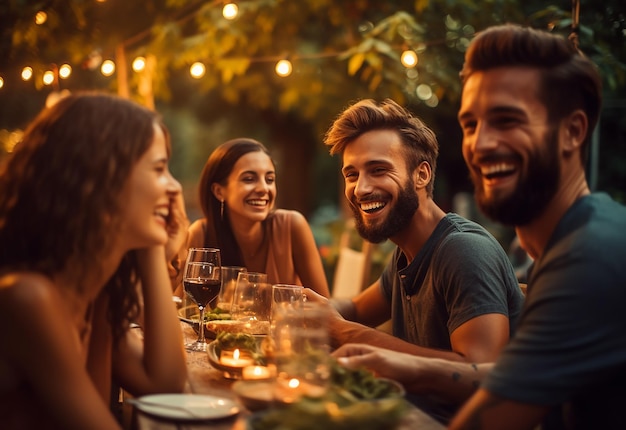
Where is `wine glasses`? wine glasses is located at coordinates (198, 284), (198, 255), (228, 275), (245, 279), (285, 290).